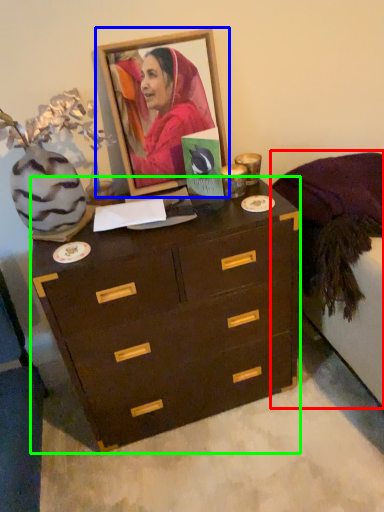
Question: Which object is the farthest from bed frame (highlighted by a red box)? Choose among these: picture frame (highlighted by a blue box) or chest of drawers (highlighted by a green box).

Choices:
 (A) picture frame
 (B) chest of drawers

Answer: (A)